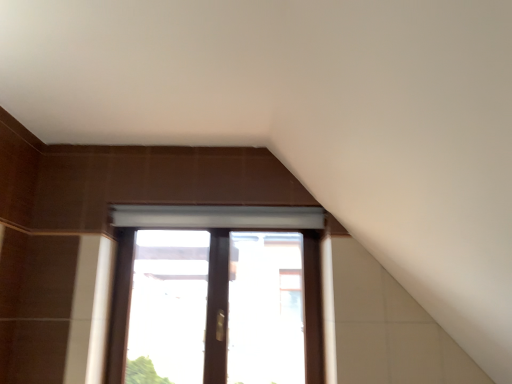
Where is `brown wooden window at center`? The image size is (512, 384). brown wooden window at center is located at coordinates (216, 295).

Measure the distance between brown wooden window at center and camera.

brown wooden window at center is 2.19 meters from camera.

Describe the element at coordinates (216, 295) in the screenshot. Image resolution: width=512 pixels, height=384 pixels. I see `brown wooden window at center` at that location.

Find the location of a particular element. This screenshot has height=384, width=512. brown wooden window at center is located at coordinates (216, 295).